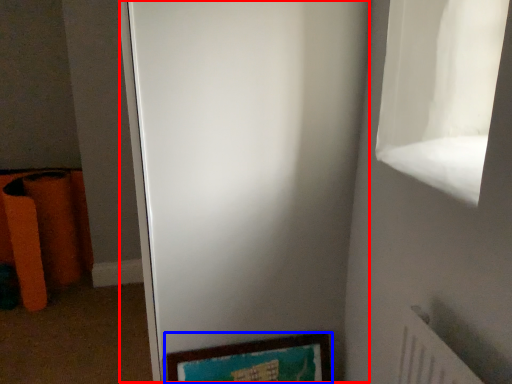
Question: Which of the following is the closest to the observer, screen door (highlighted by a red box) or picture frame (highlighted by a blue box)?

Choices:
 (A) screen door
 (B) picture frame

Answer: (A)